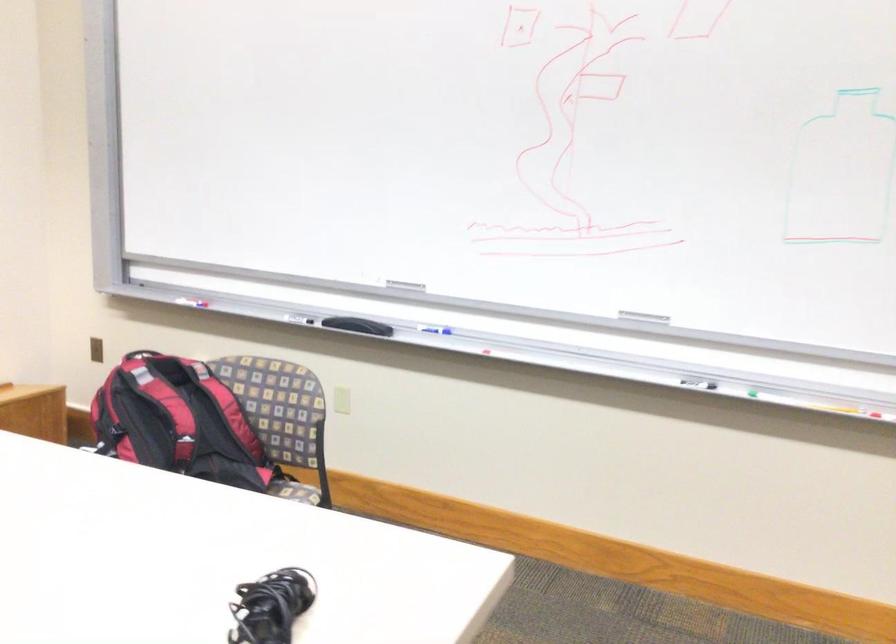
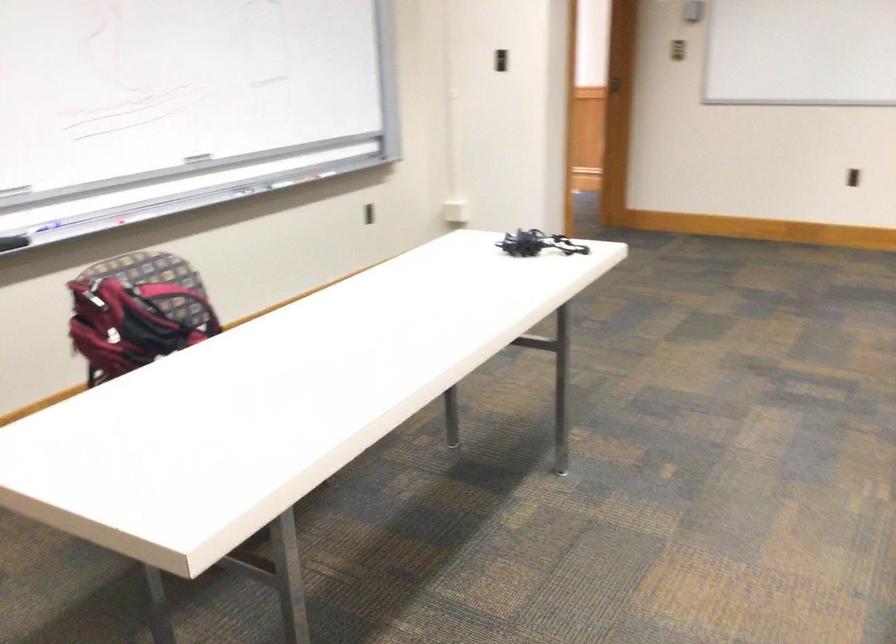
Where in the second image is the point corresponding to pixel 636 328 from the first image?

(193, 164)